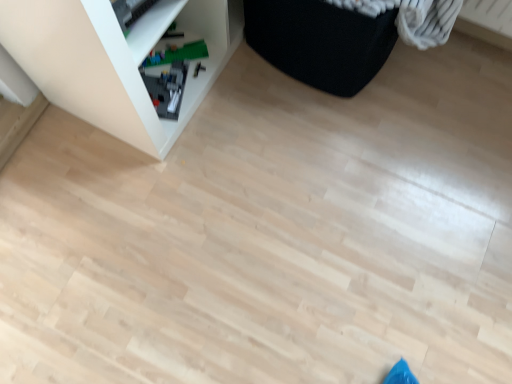
Question: Is black fabric ottoman at upper right far from white plastic shelf at upper left?

Choices:
 (A) no
 (B) yes

Answer: (A)

Question: Does black fabric ottoman at upper right lie behind white plastic shelf at upper left?

Choices:
 (A) yes
 (B) no

Answer: (A)

Question: Can you confirm if black fabric ottoman at upper right is wider than white plastic shelf at upper left?

Choices:
 (A) no
 (B) yes

Answer: (B)

Question: Does black fabric ottoman at upper right have a lesser width compared to white plastic shelf at upper left?

Choices:
 (A) no
 (B) yes

Answer: (A)

Question: From a real-world perspective, is black fabric ottoman at upper right located beneath white plastic shelf at upper left?

Choices:
 (A) no
 (B) yes

Answer: (B)

Question: From the image's perspective, is black fabric ottoman at upper right located above white plastic shelf at upper left?

Choices:
 (A) no
 (B) yes

Answer: (B)

Question: Does green plastic toy at lower left appear on the left side of white plastic shelf at upper left?

Choices:
 (A) no
 (B) yes

Answer: (A)

Question: From a real-world perspective, is green plastic toy at lower left positioned under white plastic shelf at upper left based on gravity?

Choices:
 (A) no
 (B) yes

Answer: (B)

Question: Is green plastic toy at lower left beside white plastic shelf at upper left?

Choices:
 (A) no
 (B) yes

Answer: (A)

Question: Considering the relative sizes of green plastic toy at lower left and white plastic shelf at upper left in the image provided, is green plastic toy at lower left bigger than white plastic shelf at upper left?

Choices:
 (A) yes
 (B) no

Answer: (B)

Question: Is green plastic toy at lower left shorter than white plastic shelf at upper left?

Choices:
 (A) yes
 (B) no

Answer: (A)

Question: From the image's perspective, does green plastic toy at lower left appear higher than white plastic shelf at upper left?

Choices:
 (A) yes
 (B) no

Answer: (B)

Question: Is the depth of black fabric ottoman at upper right less than that of green plastic toy at lower left?

Choices:
 (A) no
 (B) yes

Answer: (B)